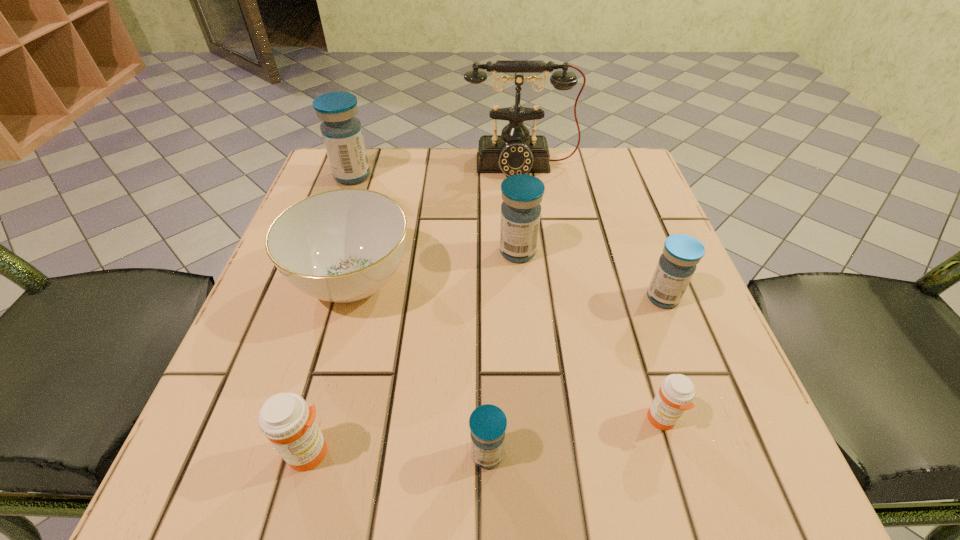
Identify the location of black telephone. The height and width of the screenshot is (540, 960). (515, 151).

Find the location of `the tallest object`. the tallest object is located at coordinates (515, 151).

Where is `the farthest medicine`? The height and width of the screenshot is (540, 960). the farthest medicine is located at coordinates (342, 134).

This screenshot has width=960, height=540. Find the location of `the leftmost blue medicine`. the leftmost blue medicine is located at coordinates (342, 134).

Where is `the fifth nearest medicine`? the fifth nearest medicine is located at coordinates (522, 194).

At what (x,y) coordinates should I click in order to perform the action: click on the second tallest medicine. Please return your answer as a coordinate pair (x, y). Image resolution: width=960 pixels, height=540 pixels. Looking at the image, I should click on (522, 194).

Where is `chinaware`? The width and height of the screenshot is (960, 540). chinaware is located at coordinates (343, 245).

Identify the location of the fourth nearest medicine. [677, 264].

The width and height of the screenshot is (960, 540). Identify the location of the third farthest blue medicine. (677, 264).

At what (x,y) coordinates should I click in order to perform the action: click on the bigger orange medicine. Please return your answer as a coordinate pair (x, y). The image size is (960, 540). Looking at the image, I should click on (285, 419).